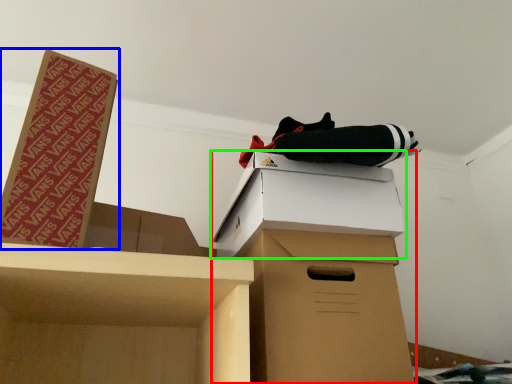
Question: Which is nearer to the cardboard box (highlighted by a red box)? box (highlighted by a blue box) or box (highlighted by a green box).

Choices:
 (A) box
 (B) box

Answer: (B)